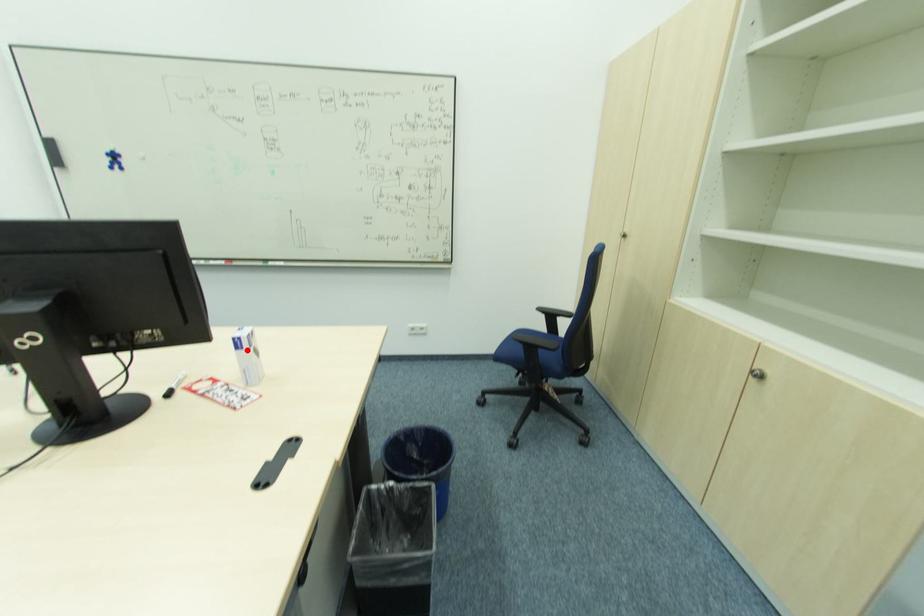
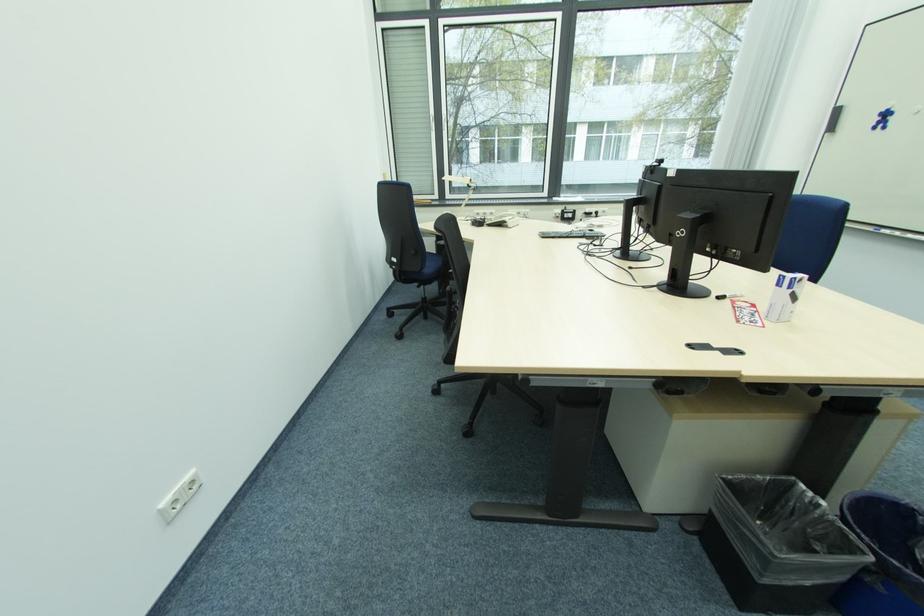
Where in the second image is the point corresponding to the highlighted location from the first image?

(784, 288)